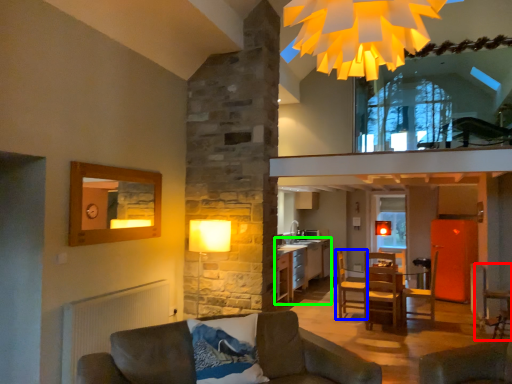
Question: Which is farther away from armchair (highlighted by a red box)? armchair (highlighted by a blue box) or cabinetry (highlighted by a green box)?

Choices:
 (A) armchair
 (B) cabinetry

Answer: (B)